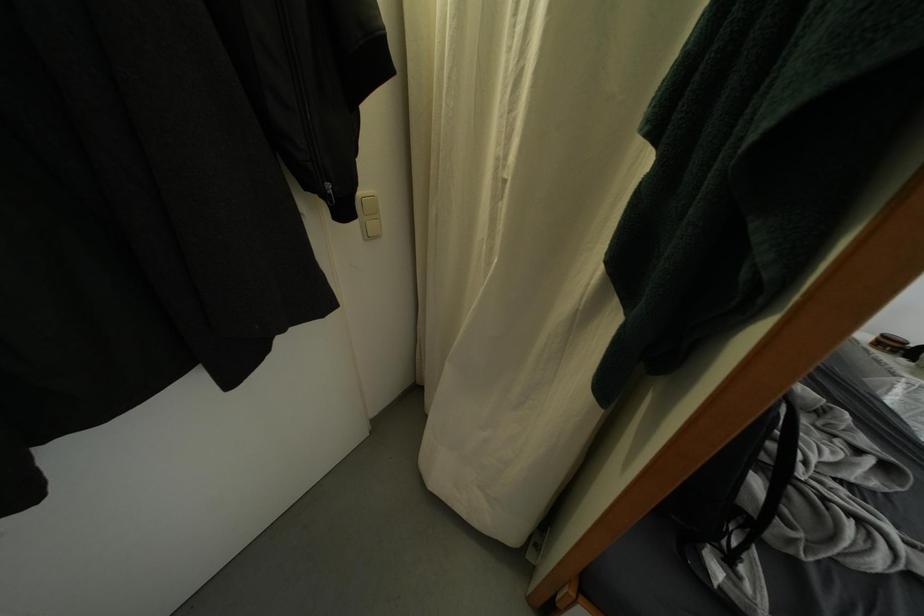
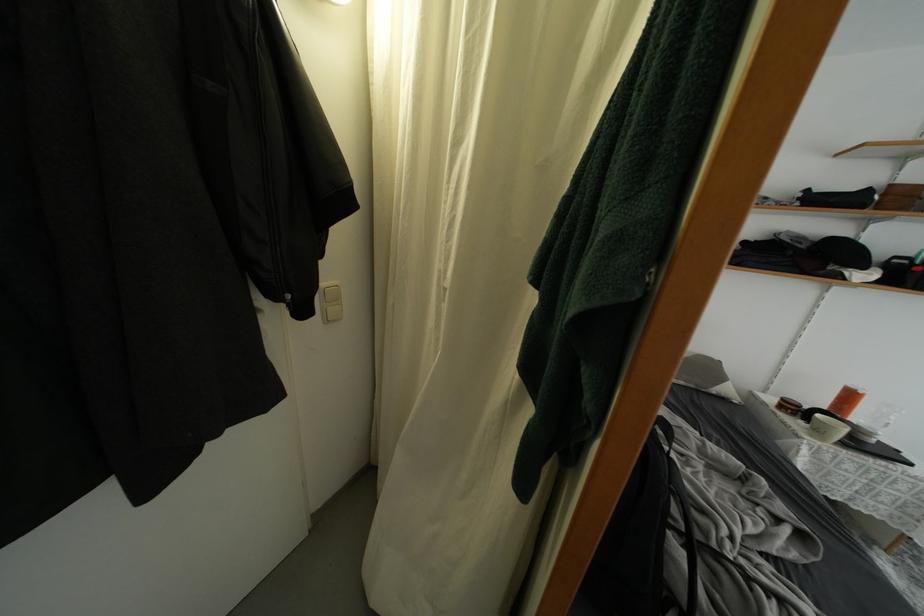
Find the pixel in the second image that matches point (351, 215) in the first image.

(310, 315)